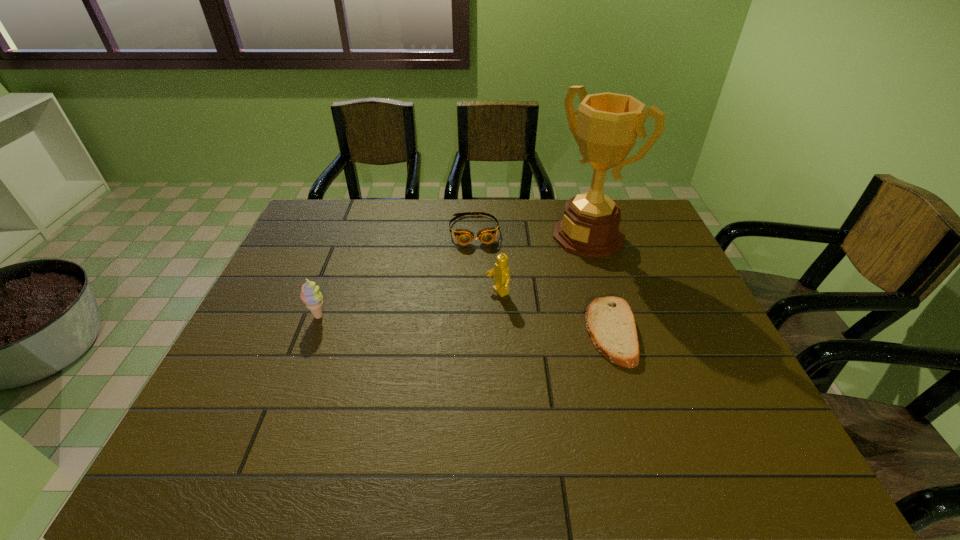
The width and height of the screenshot is (960, 540). Find the location of `sherbert`. sherbert is located at coordinates (310, 295).

I want to click on the shortest object, so click(x=609, y=320).

Identify the location of award. (608, 124).

Identify the location of the fourth tallest object. (487, 235).

You are a GUI agent. You are given a task and a screenshot of the screen. Output one action in this format:
    pyautogui.click(x=<x>, y=<y>)
    Task: Click on the Lego
    
    Given the screenshot: What is the action you would take?
    pyautogui.click(x=501, y=275)

This screenshot has width=960, height=540. Identify the location of vacant region located 0.110m on the front of the sherbert. (303, 357).

I want to click on vacant point located 0.210m on the back of the shortest object, so click(x=588, y=252).

Identify the location of vacant space located 0.280m on the front-facing side of the tallest object. This screenshot has height=540, width=960. (499, 292).

What are the coordinates of `blank space located 0.120m on the front-facing side of the tallest object` in the screenshot? It's located at (539, 268).

The image size is (960, 540). I want to click on free location located on the front-facing side of the tallest object, so click(534, 271).